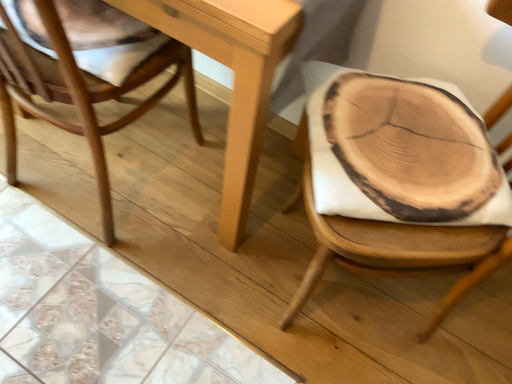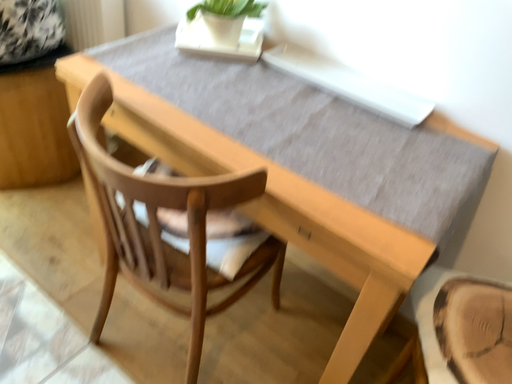
Question: How did the camera likely rotate when shooting the video?

Choices:
 (A) rotated upward
 (B) rotated downward

Answer: (A)